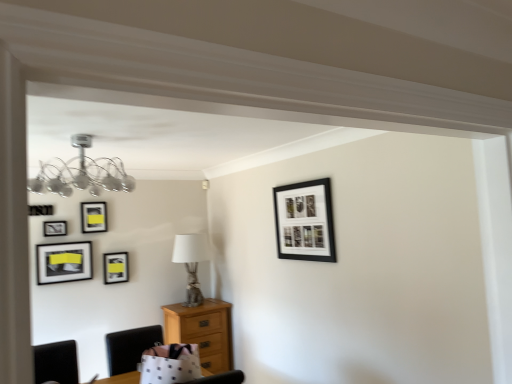
Question: Does matte black picture frame at upper left, positioned as the third picture frame in right-to-left order, have a lesser width compared to light brown wooden chest of drawers at lower left?

Choices:
 (A) yes
 (B) no

Answer: (A)

Question: Considering the relative sizes of matte black picture frame at upper left, positioned as the third picture frame in right-to-left order, and light brown wooden chest of drawers at lower left in the image provided, is matte black picture frame at upper left, positioned as the third picture frame in right-to-left order, taller than light brown wooden chest of drawers at lower left?

Choices:
 (A) no
 (B) yes

Answer: (A)

Question: Would you consider matte black picture frame at upper left, the fourth picture frame positioned from the front, to be distant from light brown wooden chest of drawers at lower left?

Choices:
 (A) no
 (B) yes

Answer: (B)

Question: Is matte black picture frame at upper left, which is the 3th picture frame in left-to-right order, smaller than light brown wooden chest of drawers at lower left?

Choices:
 (A) no
 (B) yes

Answer: (B)

Question: Is matte black picture frame at upper left, the fourth picture frame positioned from the front, not inside light brown wooden chest of drawers at lower left?

Choices:
 (A) no
 (B) yes

Answer: (B)

Question: Based on their sizes in the image, would you say white fabric lampshade at center is bigger or smaller than matte black picture frame at upper right, positioned as the fifth picture frame in back-to-front order?

Choices:
 (A) big
 (B) small

Answer: (A)

Question: Choose the correct answer: Is white fabric lampshade at center inside matte black picture frame at upper right, the first picture frame viewed from the front, or outside it?

Choices:
 (A) inside
 (B) outside

Answer: (B)

Question: In the image, is white fabric lampshade at center positioned in front of or behind matte black picture frame at upper right, the 5th picture frame in the left-to-right sequence?

Choices:
 (A) behind
 (B) front

Answer: (A)

Question: Looking at their shapes, would you say white fabric lampshade at center is wider or thinner than matte black picture frame at upper right, the first picture frame viewed from the front?

Choices:
 (A) thin
 (B) wide

Answer: (B)

Question: From a real-world perspective, is matte black picture frame at upper left, the 1th picture frame in the back-to-front sequence, above or below chrome metallic chandelier at upper left?

Choices:
 (A) above
 (B) below

Answer: (B)

Question: Visually, is matte black picture frame at upper left, which is counted as the fifth picture frame, starting from the front, positioned to the left or to the right of chrome metallic chandelier at upper left?

Choices:
 (A) right
 (B) left

Answer: (B)

Question: In terms of size, does matte black picture frame at upper left, which is counted as the fifth picture frame, starting from the front, appear bigger or smaller than chrome metallic chandelier at upper left?

Choices:
 (A) big
 (B) small

Answer: (B)

Question: Does point (117, 263) appear closer or farther from the camera than point (60, 162)?

Choices:
 (A) farther
 (B) closer

Answer: (A)

Question: From the image's perspective, is light brown wooden chest of drawers at lower left above or below matte black picture frame at upper left, which is the 3th picture frame in left-to-right order?

Choices:
 (A) above
 (B) below

Answer: (B)

Question: From their relative heights in the image, would you say light brown wooden chest of drawers at lower left is taller or shorter than matte black picture frame at upper left, positioned as the third picture frame in right-to-left order?

Choices:
 (A) tall
 (B) short

Answer: (A)